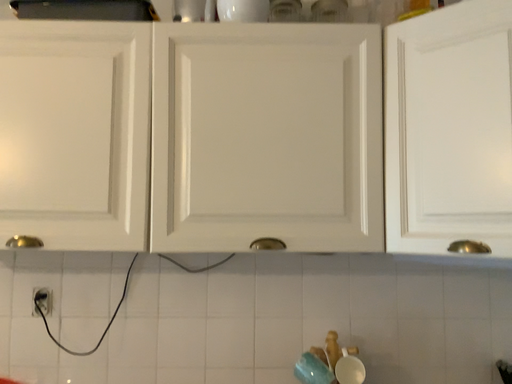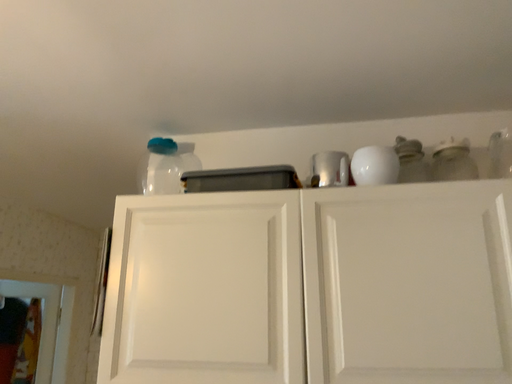
Question: How did the camera likely rotate when shooting the video?

Choices:
 (A) rotated upward
 (B) rotated downward

Answer: (A)